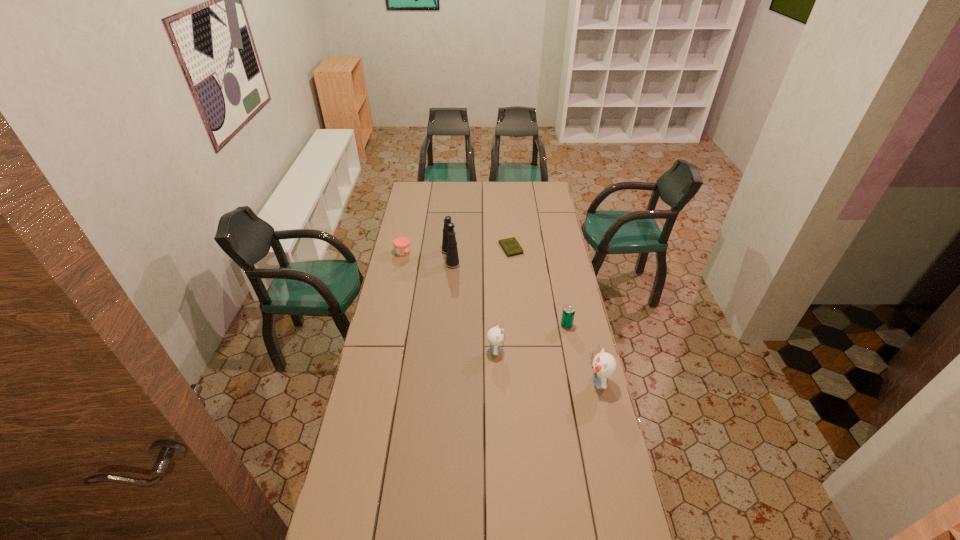
The height and width of the screenshot is (540, 960). I want to click on free space between the shorter kitten and the fifth object from right to left, so click(473, 304).

Identify the location of free point between the left kitten and the nearest object. The height and width of the screenshot is (540, 960). 547,367.

This screenshot has width=960, height=540. I want to click on free space between the second object from left to right and the diary, so click(481, 253).

The width and height of the screenshot is (960, 540). Find the location of `free space that is in between the shorter kitten and the diary`. free space that is in between the shorter kitten and the diary is located at coordinates click(x=503, y=300).

You are a GUI agent. You are given a task and a screenshot of the screen. Output one action in this format:
    pyautogui.click(x=<x>, y=<y>)
    Task: Click on the unoccupied area between the second nearest object and the third nearest object
    
    Given the screenshot: What is the action you would take?
    pyautogui.click(x=531, y=338)

I want to click on vacant region between the shortest object and the left kitten, so click(503, 300).

Locate an element on the screen. free space between the second tallest object and the fourth shortest object is located at coordinates (547, 367).

You are a GUI agent. You are given a task and a screenshot of the screen. Output one action in this format:
    pyautogui.click(x=<x>, y=<y>)
    Task: Click on the object that ranks as the closest to the fourth tallest object
    This screenshot has width=960, height=540.
    Given the screenshot: What is the action you would take?
    pyautogui.click(x=604, y=365)

Image resolution: width=960 pixels, height=540 pixels. In order to click on object that stands as the fifth closest to the beer can in this screenshot , I will do `click(401, 244)`.

Where is `vacant space that satisfies the following two spatial constraints: 1. on the front side of the shortest object; 2. on the right side of the second object from right to left`? vacant space that satisfies the following two spatial constraints: 1. on the front side of the shortest object; 2. on the right side of the second object from right to left is located at coordinates (517, 326).